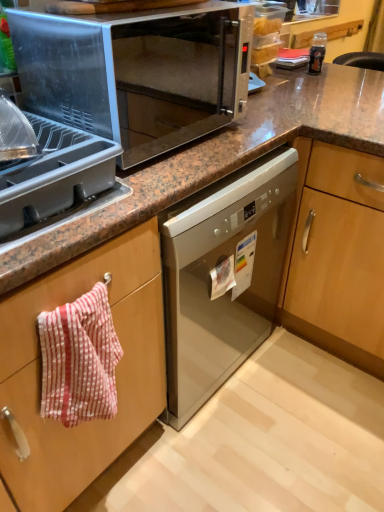
Find the location of `free location above red striped towel at left (from a real-world perspective)`. free location above red striped towel at left (from a real-world perspective) is located at coordinates (66, 300).